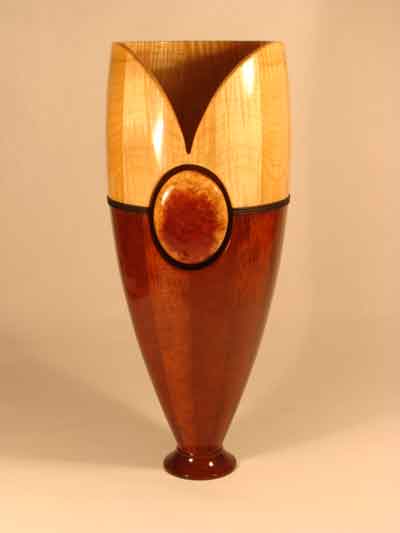
Image resolution: width=400 pixels, height=533 pixels. Find the location of `shadows made from vase`. shadows made from vase is located at coordinates (93, 429), (286, 406).